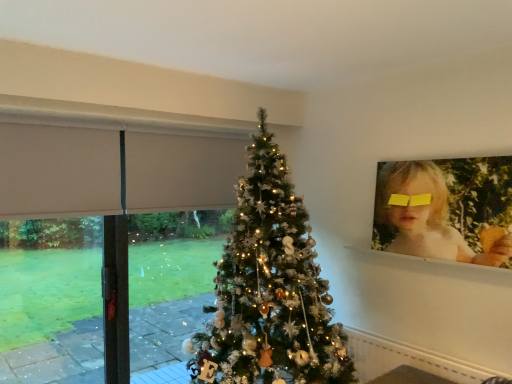
The image size is (512, 384). What do you see at coordinates (184, 174) in the screenshot? I see `beige fabric at left` at bounding box center [184, 174].

Image resolution: width=512 pixels, height=384 pixels. Identify the location of blonde hair at upper right. point(445,209).

Considering the relative sizes of white glossy window sill at upper right and white glittery christmas tree at center in the image provided, is white glossy window sill at upper right bigger than white glittery christmas tree at center?

Actually, white glossy window sill at upper right might be smaller than white glittery christmas tree at center.

Image resolution: width=512 pixels, height=384 pixels. I want to click on christmas tree lying below the white glossy window sill at upper right (from the image's perspective), so click(269, 289).

From the image's perspective, would you say white glossy window sill at upper right is shown under white glittery christmas tree at center?

Actually, white glossy window sill at upper right appears above white glittery christmas tree at center in the image.

Can you see white glossy window sill at upper right touching white glittery christmas tree at center?

They are not placed beside each other.

Which point is more forward, (492, 274) or (458, 229)?

The point (492, 274) is in front.

From the image's perspective, which is below, white glossy window sill at upper right or blonde hair at upper right?

From the image's view, white glossy window sill at upper right is below.

Locate an element on the screen. This screenshot has height=384, width=512. person above the white glossy window sill at upper right (from the image's perspective) is located at coordinates (445, 209).

From a real-world perspective, is white glossy window sill at upper right located beneath blonde hair at upper right?

Indeed, from a real-world perspective, white glossy window sill at upper right is positioned beneath blonde hair at upper right.

Can you confirm if white glittery christmas tree at center is positioned to the left of white glossy window sill at upper right?

Correct, you'll find white glittery christmas tree at center to the left of white glossy window sill at upper right.

Looking at this image, is white glossy window sill at upper right at the back of white glittery christmas tree at center?

A: white glittery christmas tree at center is not turned away from white glossy window sill at upper right.

Is white glossy window sill at upper right surrounded by white glittery christmas tree at center?

Actually, white glossy window sill at upper right is outside white glittery christmas tree at center.

Is point (257, 354) behind point (375, 259)?

No.

Which is farther, (245,330) or (395,241)?

The point (395,241) is behind.

Is white glittery christmas tree at center aimed at blonde hair at upper right?

No, white glittery christmas tree at center does not turn towards blonde hair at upper right.

Consider the image. Is white glittery christmas tree at center surrounding blonde hair at upper right?

No, blonde hair at upper right is not a part of white glittery christmas tree at center.

Is white glittery christmas tree at center to the right of blonde hair at upper right from the viewer's perspective?

In fact, white glittery christmas tree at center is to the left of blonde hair at upper right.

Consider the image. Which is more to the left, white glossy window sill at upper right or beige fabric at left?

Positioned to the left is beige fabric at left.

Is white glossy window sill at upper right turned away from beige fabric at left?

That's not correct — white glossy window sill at upper right is not looking away from beige fabric at left.

This screenshot has height=384, width=512. In order to click on window sill that is in front of the beige fabric at left in this screenshot , I will do `click(431, 266)`.

Is beige fabric at left completely or partially inside white glossy window sill at upper right?

No, beige fabric at left is not surrounded by white glossy window sill at upper right.

The height and width of the screenshot is (384, 512). Find the location of `christmas tree that is in front of the beige fabric at left`. christmas tree that is in front of the beige fabric at left is located at coordinates (x=269, y=289).

Which of these two, white glittery christmas tree at center or beige fabric at left, stands taller?

With more height is white glittery christmas tree at center.

Is white glittery christmas tree at center surrounding beige fabric at left?

No, beige fabric at left is not surrounded by white glittery christmas tree at center.

Measure the distance between white glittery christmas tree at center and beige fabric at left.

white glittery christmas tree at center is 32.15 inches from beige fabric at left.

From a real-world perspective, between blonde hair at upper right and white glossy window sill at upper right, who is vertically lower?

white glossy window sill at upper right, from a real-world perspective.

You are a GUI agent. You are given a task and a screenshot of the screen. Output one action in this format:
    pyautogui.click(x=<x>, y=<y>)
    Task: Click on the window sill that is on the left side of blonde hair at upper right
    The width and height of the screenshot is (512, 384).
    Given the screenshot: What is the action you would take?
    pyautogui.click(x=431, y=266)

Considering the relative positions of blonde hair at upper right and white glossy window sill at upper right in the image provided, is blonde hair at upper right to the left or to the right of white glossy window sill at upper right?

Clearly, blonde hair at upper right is on the right of white glossy window sill at upper right in the image.

Is blonde hair at upper right outside of white glossy window sill at upper right?

Absolutely, blonde hair at upper right is external to white glossy window sill at upper right.

Identify the location of christmas tree in front of the white glossy window sill at upper right. (269, 289).

Identify the location of person to the right of white glossy window sill at upper right. (445, 209).

Looking at the image, which one is located closer to white glossy window sill at upper right, beige fabric at left or white glittery christmas tree at center?

white glittery christmas tree at center.

Looking at the image, which one is located further to white glossy window sill at upper right, beige fabric at left or blonde hair at upper right?

beige fabric at left lies further to white glossy window sill at upper right than the other object.

Estimate the real-world distances between objects in this image. Which object is further from white glossy window sill at upper right, blonde hair at upper right or white glittery christmas tree at center?

Among the two, white glittery christmas tree at center is located further to white glossy window sill at upper right.

Based on their spatial positions, is white glittery christmas tree at center or blonde hair at upper right further from beige fabric at left?

Result: The object further to beige fabric at left is blonde hair at upper right.

In the scene shown: Based on their spatial positions, is white glossy window sill at upper right or blonde hair at upper right closer to white glittery christmas tree at center?

Based on the image, blonde hair at upper right appears to be nearer to white glittery christmas tree at center.

Looking at the image, which one is located further to white glittery christmas tree at center, white glossy window sill at upper right or beige fabric at left?

white glossy window sill at upper right lies further to white glittery christmas tree at center than the other object.

Considering their positions, is blonde hair at upper right positioned further to beige fabric at left than white glittery christmas tree at center?

The object further to beige fabric at left is blonde hair at upper right.

When comparing their distances from blonde hair at upper right, does white glittery christmas tree at center or white glossy window sill at upper right seem further?

Among the two, white glittery christmas tree at center is located further to blonde hair at upper right.

Locate an element on the screen. window sill between beige fabric at left and blonde hair at upper right from left to right is located at coordinates (431, 266).

What are the coordinates of `christmas tree between beige fabric at left and blonde hair at upper right` in the screenshot? It's located at (269, 289).

Image resolution: width=512 pixels, height=384 pixels. In order to click on window sill situated between white glittery christmas tree at center and blonde hair at upper right from left to right in this screenshot , I will do `click(431, 266)`.

Locate an element on the screen. This screenshot has height=384, width=512. christmas tree situated between beige fabric at left and white glossy window sill at upper right from left to right is located at coordinates (269, 289).